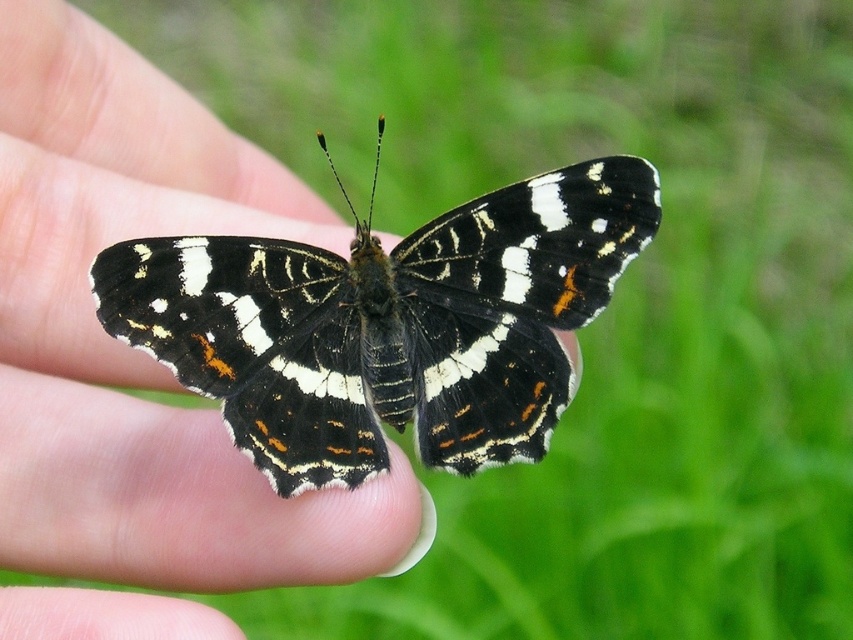
You are a photographer trying to capture the butterfly on the smooth skin at center. If you want to adjust your camera focus to the exact position where the butterfly is resting, what coordinates should you aim for?

You should aim the camera focus at the coordinates point (132, 349) where the smooth skin at center is located to capture the butterfly accurately.

You are a photographer trying to capture the butterfly on the hand. Since you want to focus on the butterfly, which object should you adjust your camera focus to be closer to, the smooth skin at center or the black glossy butterfly at center?

The smooth skin at center is closer to the viewer than the black glossy butterfly at center, so to focus on the butterfly, adjust the camera focus to be closer to the black glossy butterfly at center.